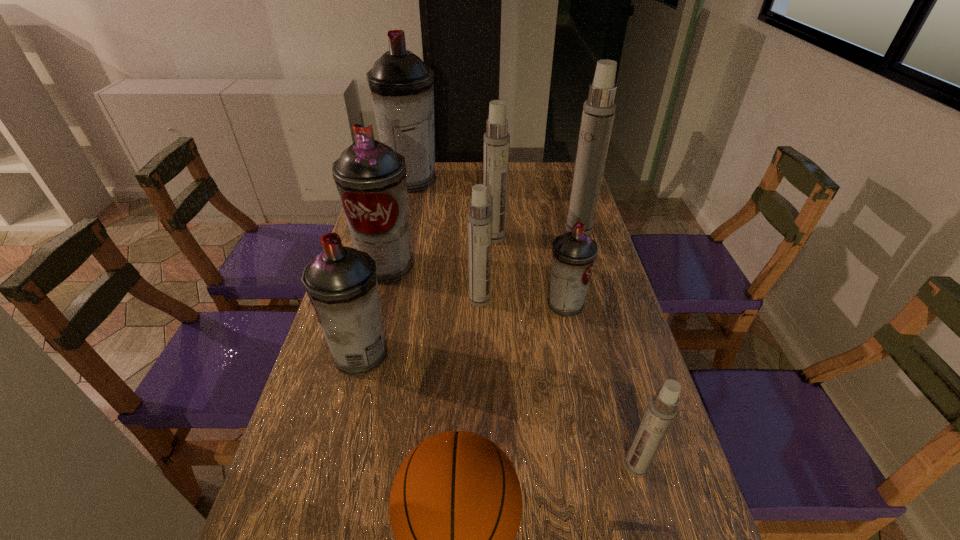
Identify which object is the sixth nearest to the second nearest white aerosol can. Please provide its 2D coordinates. Your answer should be formatted as a tuple, i.e. [(x, y)], where the tuple contains the x and y coordinates of a point satisfying the conditions above.

[(455, 507)]

Where is `aerosol can object that ranks as the fifth closest to the smallest white aerosol can`? Image resolution: width=960 pixels, height=540 pixels. aerosol can object that ranks as the fifth closest to the smallest white aerosol can is located at coordinates (496, 146).

Select which aerosol can appears as the closest to the shortest object. Please provide its 2D coordinates. Your answer should be formatted as a tuple, i.e. [(x, y)], where the tuple contains the x and y coordinates of a point satisfying the conditions above.

[(662, 409)]

The width and height of the screenshot is (960, 540). Find the location of `gray aerosol can that stands as the third closest to the fifth nearest aerosol can`. gray aerosol can that stands as the third closest to the fifth nearest aerosol can is located at coordinates (574, 253).

Select which gray aerosol can appears as the closest to the smallest white aerosol can. Please provide its 2D coordinates. Your answer should be formatted as a tuple, i.e. [(x, y)], where the tuple contains the x and y coordinates of a point satisfying the conditions above.

[(574, 253)]

Identify which white aerosol can is the third nearest to the third smallest white aerosol can. Please provide its 2D coordinates. Your answer should be formatted as a tuple, i.e. [(x, y)], where the tuple contains the x and y coordinates of a point satisfying the conditions above.

[(662, 409)]

This screenshot has height=540, width=960. Identify the location of white aerosol can that is the second closest one to the third smallest white aerosol can. (x=479, y=219).

Locate an element on the screen. This screenshot has height=540, width=960. blank space that satisfies the following two spatial constraints: 1. on the front side of the fifth nearest aerosol can; 2. on the left side of the smallest white aerosol can is located at coordinates (337, 466).

You are a GUI agent. You are given a task and a screenshot of the screen. Output one action in this format:
    pyautogui.click(x=<x>, y=<y>)
    Task: Click on the free location that satisfies the following two spatial constraints: 1. on the back side of the farthest gray aerosol can; 2. on the left side of the seventh farthest object
    
    Given the screenshot: What is the action you would take?
    pyautogui.click(x=406, y=180)

I want to click on vacant point that satisfies the following two spatial constraints: 1. on the front side of the nearest aerosol can; 2. on the left side of the second smallest gray aerosol can, so click(333, 466).